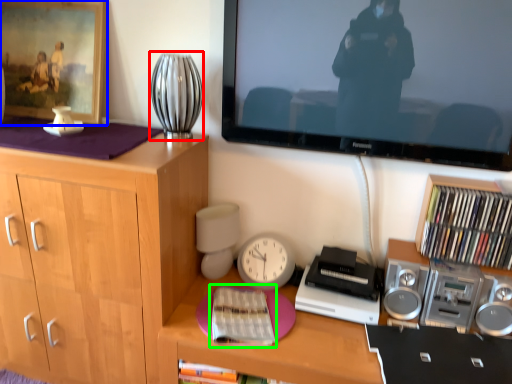
Question: Which object is the farthest from table lamp (highlighted by a red box)? Choose among these: picture frame (highlighted by a blue box) or book (highlighted by a green box).

Choices:
 (A) picture frame
 (B) book

Answer: (B)